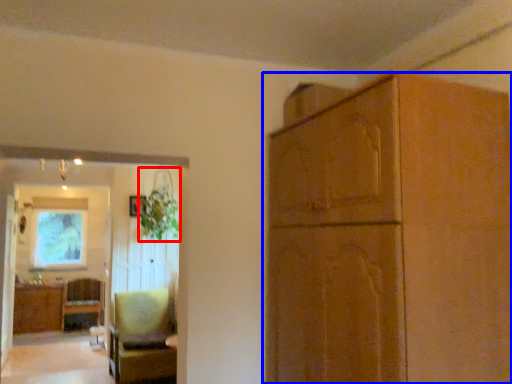
Question: Which of the following is the farthest to the observer, plant (highlighted by a red box) or cabinetry (highlighted by a blue box)?

Choices:
 (A) plant
 (B) cabinetry

Answer: (A)